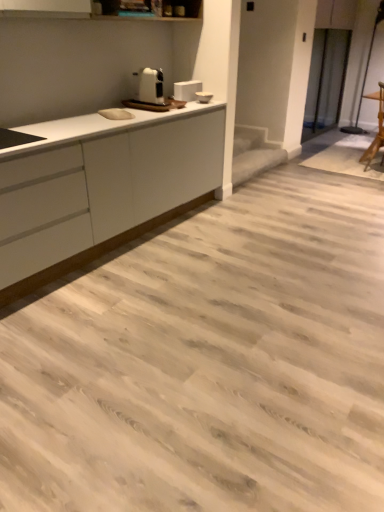
Question: Is the position of white plastic toaster at upper center more distant than that of white matte countertop at left?

Choices:
 (A) no
 (B) yes

Answer: (B)

Question: Is white plastic toaster at upper center shorter than white matte countertop at left?

Choices:
 (A) yes
 (B) no

Answer: (A)

Question: Is white plastic toaster at upper center taller than white matte countertop at left?

Choices:
 (A) no
 (B) yes

Answer: (A)

Question: Can you confirm if white plastic toaster at upper center is bigger than white matte countertop at left?

Choices:
 (A) no
 (B) yes

Answer: (A)

Question: Is white plastic toaster at upper center thinner than white matte countertop at left?

Choices:
 (A) yes
 (B) no

Answer: (A)

Question: Choose the correct answer: Is wooden chair at right inside white matte countertop at left or outside it?

Choices:
 (A) inside
 (B) outside

Answer: (B)

Question: From the image's perspective, relative to white matte countertop at left, is wooden chair at right above or below?

Choices:
 (A) below
 (B) above

Answer: (B)

Question: Is wooden chair at right wider or thinner than white matte countertop at left?

Choices:
 (A) wide
 (B) thin

Answer: (B)

Question: From their relative heights in the image, would you say wooden chair at right is taller or shorter than white matte countertop at left?

Choices:
 (A) short
 (B) tall

Answer: (B)

Question: Considering the positions of white matte countertop at left and white glossy toaster at upper center in the image, is white matte countertop at left bigger or smaller than white glossy toaster at upper center?

Choices:
 (A) small
 (B) big

Answer: (B)

Question: Is point (97, 205) closer or farther from the camera than point (188, 96)?

Choices:
 (A) farther
 (B) closer

Answer: (B)

Question: Would you say white matte countertop at left is to the left or to the right of white glossy toaster at upper center in the picture?

Choices:
 (A) left
 (B) right

Answer: (A)

Question: From the image's perspective, is white matte countertop at left above or below white glossy toaster at upper center?

Choices:
 (A) above
 (B) below

Answer: (B)

Question: Is white matte countertop at left taller or shorter than wooden chair at right?

Choices:
 (A) short
 (B) tall

Answer: (A)

Question: Is white matte countertop at left bigger or smaller than wooden chair at right?

Choices:
 (A) big
 (B) small

Answer: (A)